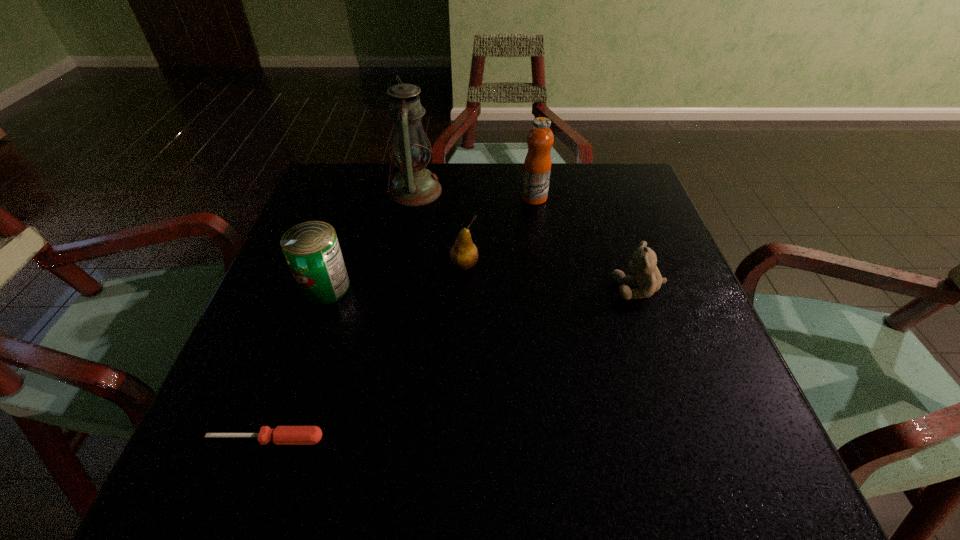
Identify the location of vacant space at the far right corner of the desktop. Image resolution: width=960 pixels, height=540 pixels. (630, 211).

Where is `free space at the near right corner of the desktop`? free space at the near right corner of the desktop is located at coordinates (722, 470).

At what (x,y) coordinates should I click in order to perform the action: click on free area in between the screwdriver and the can. Please return your answer as a coordinate pair (x, y). Looking at the image, I should click on (296, 363).

You are a GUI agent. You are given a task and a screenshot of the screen. Output one action in this format:
    pyautogui.click(x=<x>, y=<y>)
    Task: Click on the free space between the second tallest object and the can
    
    Given the screenshot: What is the action you would take?
    pyautogui.click(x=430, y=242)

You are a GUI agent. You are given a task and a screenshot of the screen. Output one action in this format:
    pyautogui.click(x=<x>, y=<y>)
    Task: Click on the blank region between the third object from right to left and the rightmost object
    
    Given the screenshot: What is the action you would take?
    pyautogui.click(x=551, y=277)

Where is `free space that is in between the nearest object and the can`? The image size is (960, 540). free space that is in between the nearest object and the can is located at coordinates (296, 363).

Find the location of a particular element. The height and width of the screenshot is (540, 960). free spot between the screwdriver and the second object from right to left is located at coordinates [400, 318].

Identify the location of vacant space that is in between the pear and the can. This screenshot has width=960, height=540. (395, 276).

The image size is (960, 540). I want to click on vacant space in between the can and the tallest object, so click(371, 239).

Locate an element on the screen. The width and height of the screenshot is (960, 540). vacant space in between the fruit juice and the can is located at coordinates click(x=430, y=242).